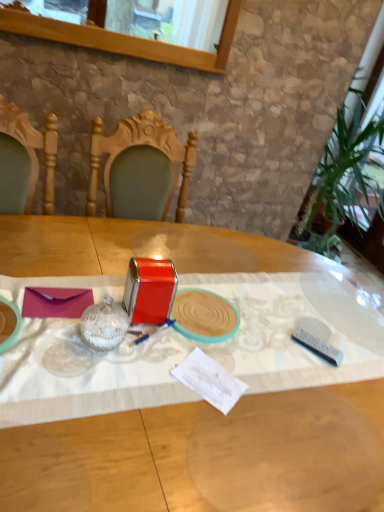
Where is `free space to the left of clear glass jar at center, acting as the 4th tableware starting from the right`? free space to the left of clear glass jar at center, acting as the 4th tableware starting from the right is located at coordinates (45, 335).